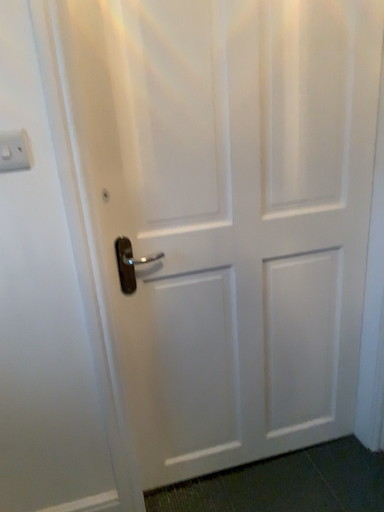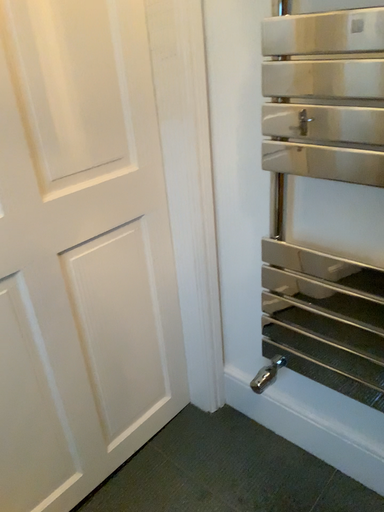
Question: How did the camera likely rotate when shooting the video?

Choices:
 (A) rotated left
 (B) rotated right

Answer: (B)